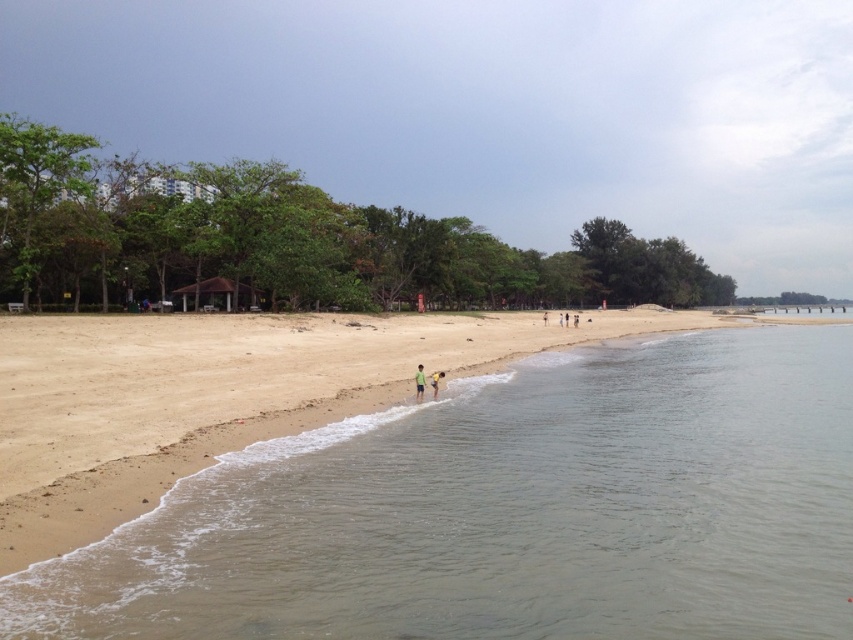
You are a photographer trying to capture a photo of the yellow fabric at lower center and the green matte shirt at center. You want to ensure both are fully visible in the frame. Which object should you prioritize framing first to avoid cropping either?

The yellow fabric at lower center has a greater width than the green matte shirt at center. To ensure both are fully visible, prioritize framing the wider yellow fabric at lower center first, then adjust the frame to include the narrower green matte shirt at center.

You are a photographer trying to capture a candid shot of the yellow fabric at lower center and the green matte shirt at center. Since you want to ensure both subjects are in focus, you need to know which one is taller. Can you tell me which object is taller?

The yellow fabric at lower center is taller than the green matte shirt at center.